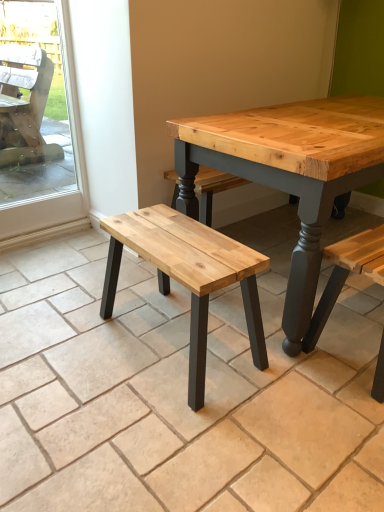
At what (x,y) coordinates should I click in order to perform the action: click on natural wood bench at center. Please return your answer as a coordinate pair (x, y). The image size is (384, 512). Looking at the image, I should click on (188, 275).

Is natural wood bench at center looking in the opposite direction of transparent glass screen door at left?

No, natural wood bench at center's orientation is not away from transparent glass screen door at left.

Is point (119, 249) positioned in front of point (70, 113)?

Yes.

Considering the positions of objects natural wood bench at center and transparent glass screen door at left in the image provided, who is behind, natural wood bench at center or transparent glass screen door at left?

transparent glass screen door at left is further away from the camera.

What's the angular difference between natural wood bench at center and transparent glass screen door at left's facing directions?

The angular difference between natural wood bench at center and transparent glass screen door at left is 90.4 degrees.

Image resolution: width=384 pixels, height=512 pixels. What are the coordinates of `stool located below the natural wood bench at center (from the image's perspective)` in the screenshot? It's located at (188, 275).

Considering the sizes of natural wood bench at center and natural wood bench at center in the image, is natural wood bench at center wider or thinner than natural wood bench at center?

natural wood bench at center is thinner than natural wood bench at center.

Is natural wood bench at center looking in the opposite direction of natural wood bench at center?

Yes.

From a real-world perspective, is natural wood bench at center positioned over natural wood bench at center based on gravity?

Incorrect, from a real-world perspective, natural wood bench at center is lower than natural wood bench at center.

Which is more distant, (6, 461) or (126, 225)?

Point (126, 225)

Does natural wood bench at center appear on the right side of natural wood bench at center?

Indeed, natural wood bench at center is positioned on the right side of natural wood bench at center.

What are the coordinates of `stool behind the natural wood bench at center` in the screenshot? It's located at (188, 275).

Can you confirm if transparent glass screen door at left is smaller than natural wood bench at center?

Correct, transparent glass screen door at left occupies less space than natural wood bench at center.

How far apart are transparent glass screen door at left and natural wood bench at center?

A distance of 3.65 feet exists between transparent glass screen door at left and natural wood bench at center.

From a real-world perspective, does transparent glass screen door at left sit lower than natural wood bench at center?

No, from a real-world perspective, transparent glass screen door at left is not below natural wood bench at center.

Is transparent glass screen door at left positioned beyond the bounds of natural wood bench at center?

transparent glass screen door at left lies outside natural wood bench at center's area.

The image size is (384, 512). In order to click on screen door lying on the left of natural wood bench at center in this screenshot , I will do `click(57, 193)`.

Is point (213, 365) behind point (13, 213)?

That is False.

Is natural wood bench at center surrounding transparent glass screen door at left?

No, transparent glass screen door at left is located outside of natural wood bench at center.

Is the position of transparent glass screen door at left more distant than that of natural wood bench at center?

Yes.

Can you confirm if transparent glass screen door at left is bigger than natural wood bench at center?

Incorrect, transparent glass screen door at left is not larger than natural wood bench at center.

Based on the photo, is transparent glass screen door at left situated inside natural wood bench at center or outside?

transparent glass screen door at left is spatially situated outside natural wood bench at center.

I want to click on screen door behind the natural wood bench at center, so pos(57,193).

The height and width of the screenshot is (512, 384). In order to click on stool above the natural wood bench at center (from a real-world perspective) in this screenshot , I will do `click(188, 275)`.

Based on the photo, looking at the image, which one is located further to transparent glass screen door at left, natural wood bench at center or natural wood bench at center?

The object further to transparent glass screen door at left is natural wood bench at center.

Based on their spatial positions, is natural wood bench at center or transparent glass screen door at left further from natural wood bench at center?

transparent glass screen door at left lies further to natural wood bench at center than the other object.

Which object lies further to the anchor point natural wood bench at center, transparent glass screen door at left or natural wood bench at center?

transparent glass screen door at left is positioned further to the anchor natural wood bench at center.

Based on their spatial positions, is transparent glass screen door at left or natural wood bench at center closer to natural wood bench at center?

natural wood bench at center is closer to natural wood bench at center.

Consider the image. From the image, which object appears to be nearer to natural wood bench at center, natural wood bench at center or transparent glass screen door at left?

natural wood bench at center.

Estimate the real-world distances between objects in this image. Which object is closer to transparent glass screen door at left, natural wood bench at center or natural wood bench at center?

natural wood bench at center is closer to transparent glass screen door at left.

The image size is (384, 512). I want to click on stool situated between transparent glass screen door at left and natural wood bench at center from left to right, so click(x=188, y=275).